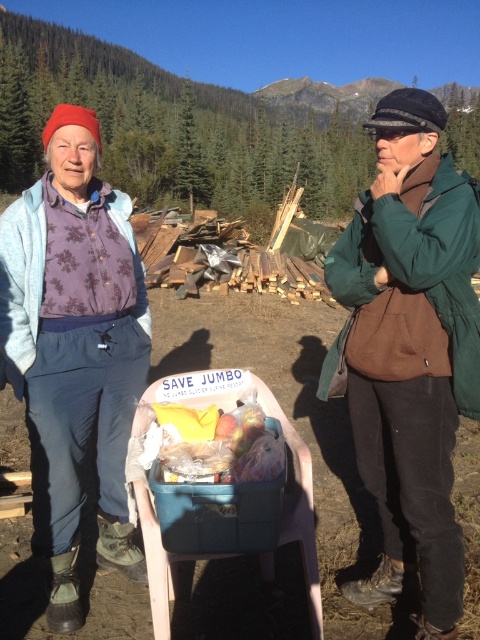
Question: Which point is closer to the camera?

Choices:
 (A) (6, 321)
 (B) (222, 426)
 (C) (402, 499)

Answer: (B)

Question: Does floral fabric shirt at center appear on the right side of translucent plastic bag at center?

Choices:
 (A) no
 (B) yes

Answer: (A)

Question: Among these objects, which one is nearest to the camera?

Choices:
 (A) green fuzzy jacket at right
 (B) translucent plastic bag at center
 (C) floral fabric shirt at center

Answer: (B)

Question: Among these points, which one is nearest to the camera?

Choices:
 (A) (417, 269)
 (B) (41, 472)
 (C) (172, 467)

Answer: (C)

Question: In this image, where is green fuzzy jacket at right located relative to translucent plastic bag at center?

Choices:
 (A) left
 (B) right

Answer: (B)

Question: Is green fuzzy jacket at right positioned at the back of floral fabric shirt at center?

Choices:
 (A) yes
 (B) no

Answer: (B)